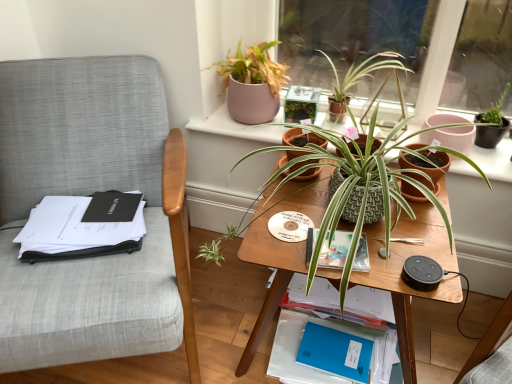
Image resolution: width=512 pixels, height=384 pixels. I want to click on free space behind hardcover book at center, which appears as the 2th paperback book when viewed from the back, so click(306, 200).